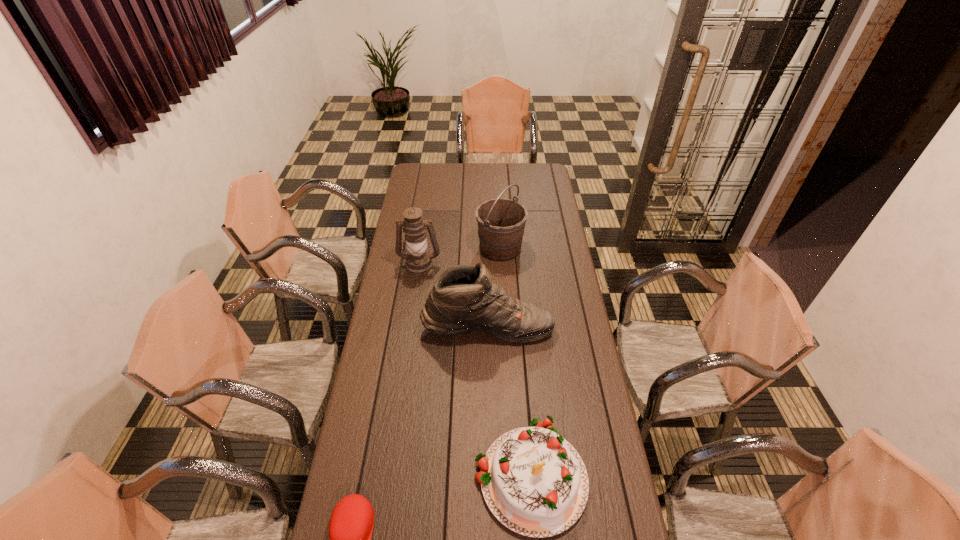
This screenshot has width=960, height=540. I want to click on bucket, so click(x=501, y=222).

What are the coordinates of `the third farthest object` in the screenshot? It's located at (464, 299).

Find the location of `oil lamp`. oil lamp is located at coordinates [x=418, y=260].

This screenshot has height=540, width=960. In order to click on the fourth tallest object in this screenshot , I will do `click(535, 483)`.

You are a GUI agent. You are given a task and a screenshot of the screen. Output one action in this format:
    pyautogui.click(x=<x>, y=<y>)
    Task: Click on the free space located on the right of the bucket
    This screenshot has width=960, height=540.
    Given the screenshot: What is the action you would take?
    556,248

Where is `vacant area situated 0.130m on the left of the third nearest object`? This screenshot has width=960, height=540. vacant area situated 0.130m on the left of the third nearest object is located at coordinates (392, 327).

Find the location of a particular element. Image resolution: width=960 pixels, height=540 pixels. blank area located on the back of the oil lamp is located at coordinates (427, 208).

Locate an element on the screen. free spot located on the left of the second shortest object is located at coordinates (372, 474).

At what (x,y) coordinates should I click in order to perform the action: click on object that is at the left edge. Please return your answer as a coordinate pair (x, y). The height and width of the screenshot is (540, 960). Looking at the image, I should click on (418, 260).

The image size is (960, 540). What are the coordinates of `ski boot that is at the right edge` in the screenshot? It's located at (464, 299).